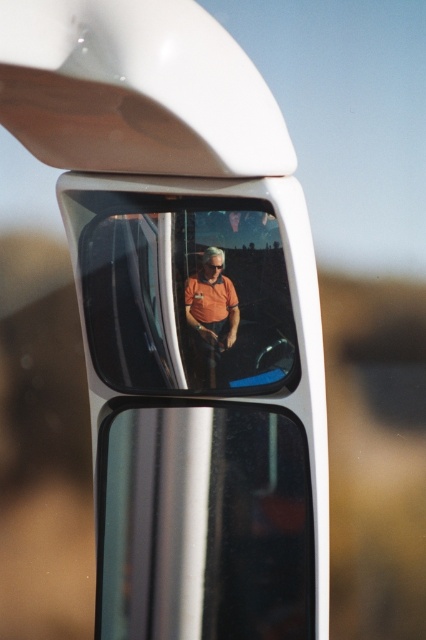
Question: Among these objects, which one is nearest to the camera?

Choices:
 (A) matte orange shirt at center
 (B) orange matte shirt at center

Answer: (A)

Question: Which point is closer to the camera?

Choices:
 (A) orange matte shirt at center
 (B) matte orange shirt at center

Answer: (B)

Question: Does matte orange shirt at center have a lesser width compared to orange matte shirt at center?

Choices:
 (A) yes
 (B) no

Answer: (B)

Question: Can you confirm if matte orange shirt at center is wider than orange matte shirt at center?

Choices:
 (A) no
 (B) yes

Answer: (B)

Question: Where is matte orange shirt at center located in relation to orange matte shirt at center in the image?

Choices:
 (A) above
 (B) below

Answer: (A)